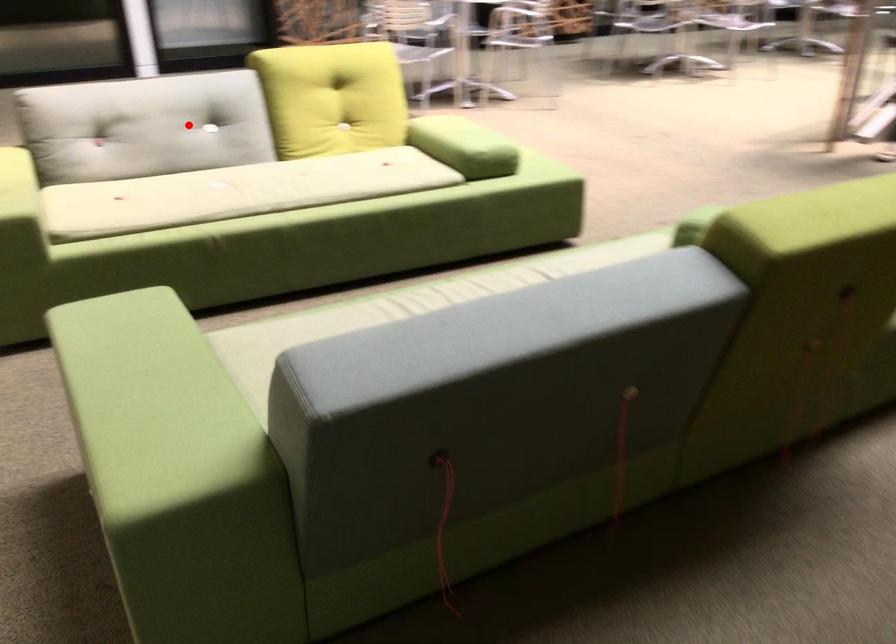
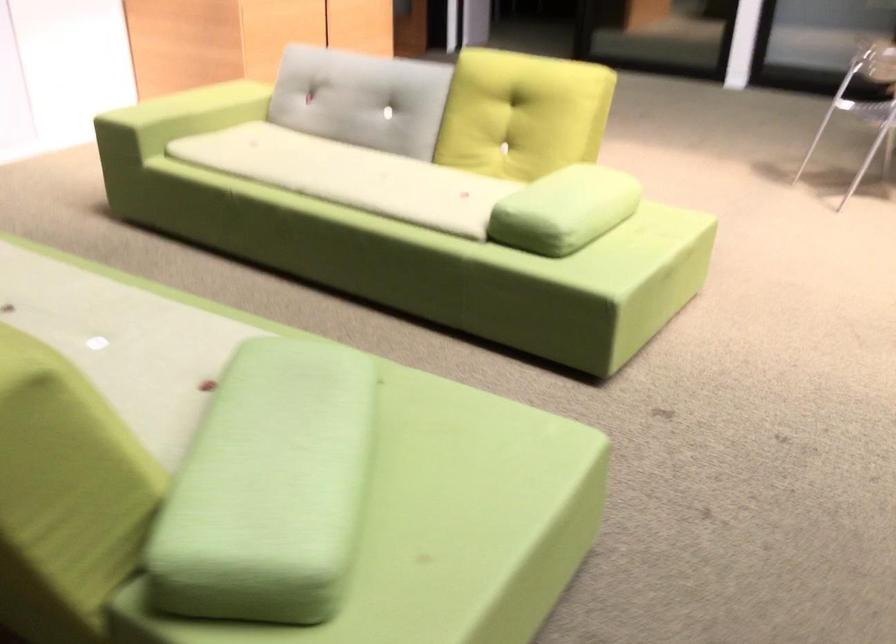
Where in the second image is the point corresponding to the highlighted location from the first image?

(362, 99)